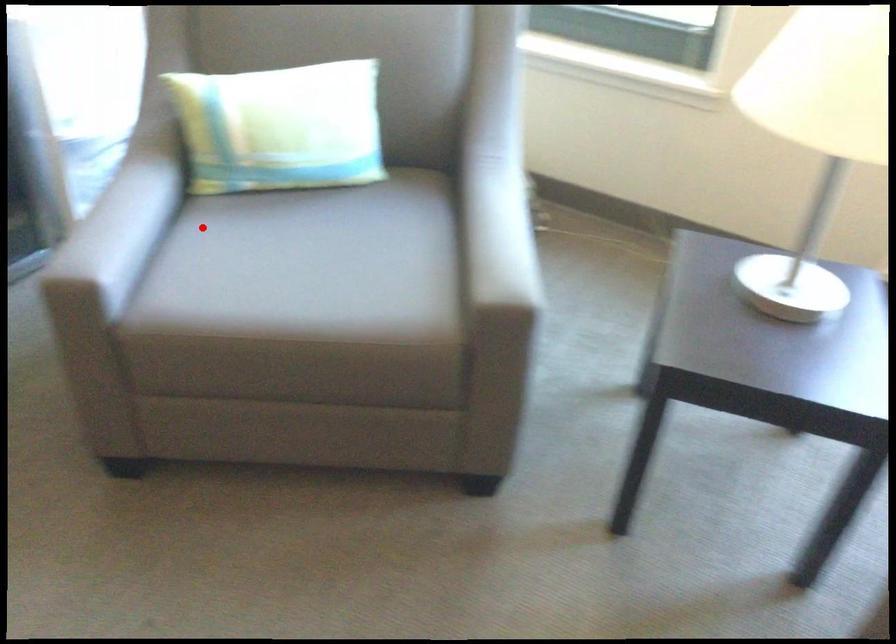
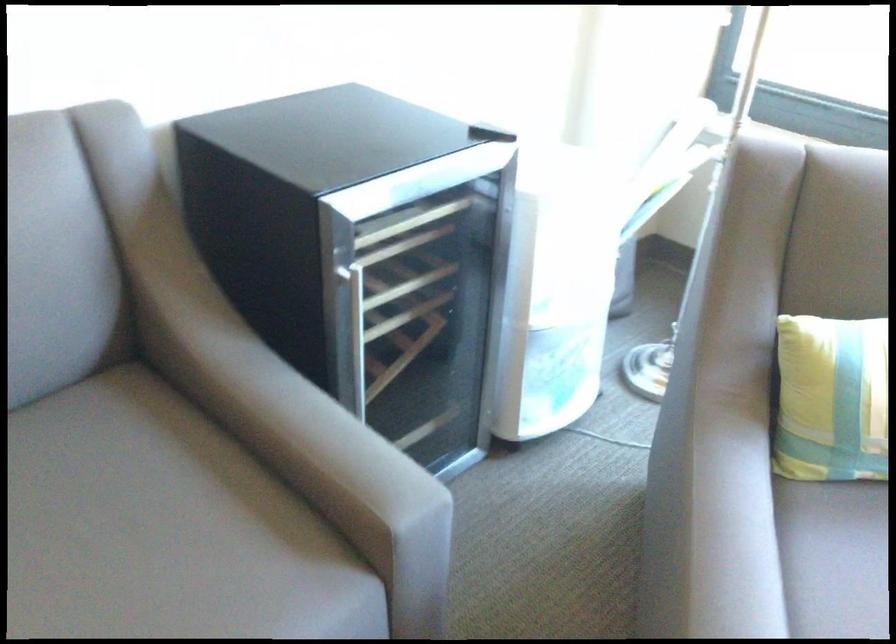
The point at the highlighted location is marked in the first image. Where is the corresponding point in the second image?

(837, 553)